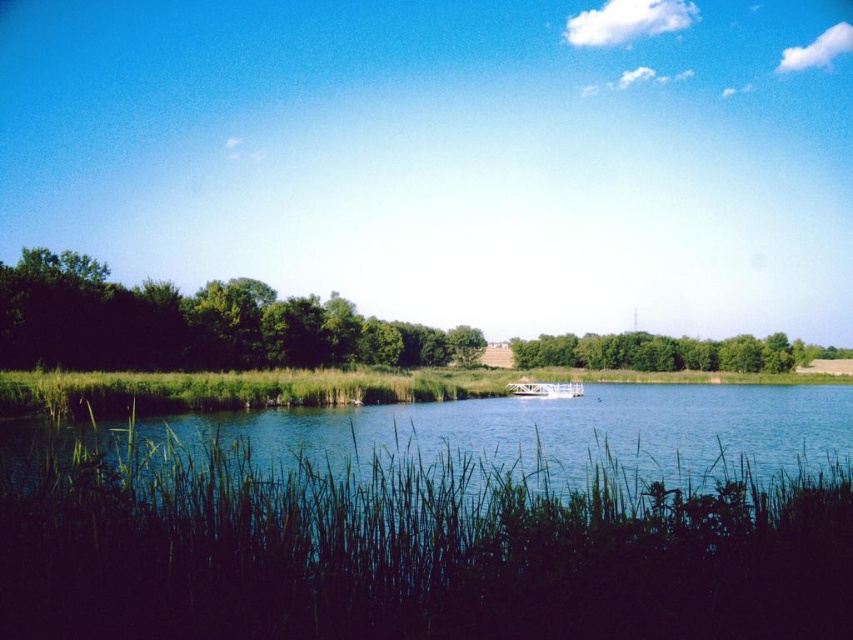
You are a photographer planning to capture the entire scene in one shot. Given that the green grassy river at center and the white glossy boat at center are both in the frame, which object occupies more horizontal space in the image?

The green grassy river at center occupies more horizontal space in the image because its width is larger than that of the white glossy boat at center.

You are an observer standing at the lakeside. You see the dark green leafy trees at left and the white glossy boat at center. Which object is positioned higher in the scene?

The dark green leafy trees at left are positioned higher in the scene than the white glossy boat at center.